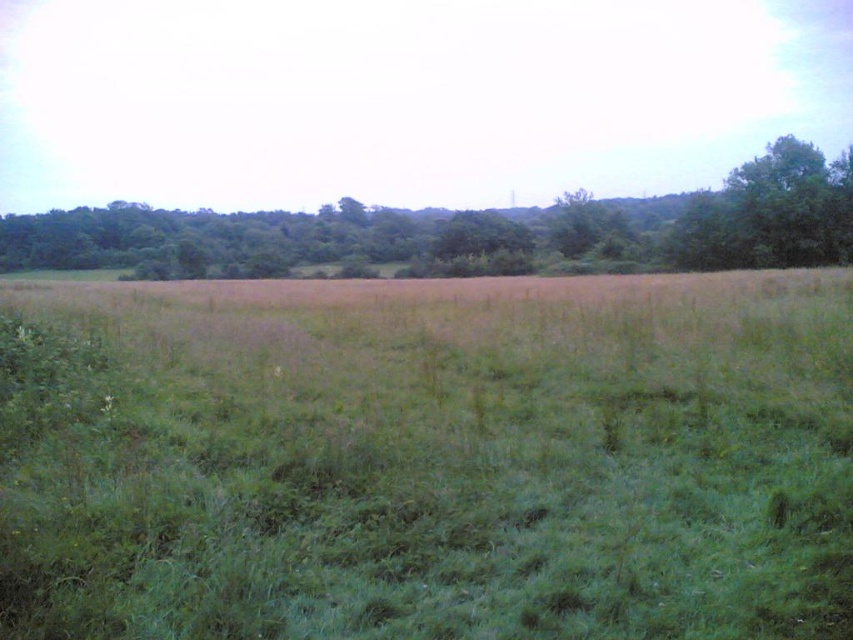
You are a gardener planning to plant new shrubs in the green grassy field at center and the green leafy tree at upper center. Based on the scene, which location would be more suitable for planting shrubs that require dense soil and minimal competition from existing plants?

The green grassy field at center is more suitable for planting shrubs that require dense soil and minimal competition from existing plants because it is thinner than the green leafy tree at upper center, indicating less vegetation density and possibly looser soil.

You are a hiker trying to navigate through the grassland. You see two landmarks, the green leafy tree at upper center and the green leafy tree at upper right. Which tree should you head towards if you want to reach the taller one?

The green leafy tree at upper center is bigger than the green leafy tree at upper right, so you should head towards the green leafy tree at upper center to reach the taller one.

You are a drone operator trying to capture a photo of the green grassy field at center and the green leafy tree at upper right. Which object will appear wider in the photo?

The green grassy field at center will appear wider in the photo because its width is larger than that of the green leafy tree at upper right.